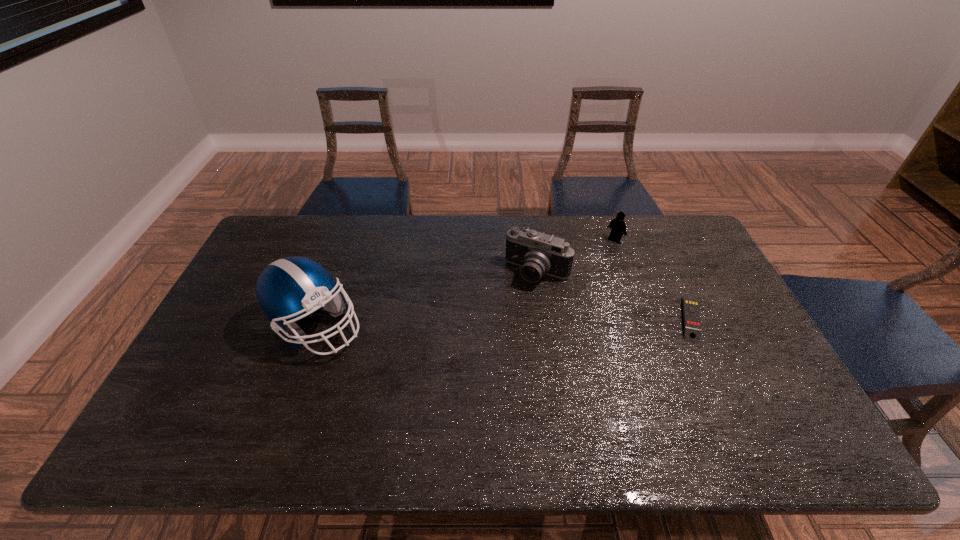
You are a GUI agent. You are given a task and a screenshot of the screen. Output one action in this format:
    pyautogui.click(x=<x>, y=<y>)
    Task: Click on the free space located 0.150m on the face of the Lego
    This screenshot has width=960, height=540.
    Given the screenshot: What is the action you would take?
    click(x=585, y=263)

You are a GUI agent. You are given a task and a screenshot of the screen. Output one action in this format:
    pyautogui.click(x=<x>, y=<y>)
    Task: Click on the vacant space located on the face of the Lego
    The image size is (960, 540).
    Given the screenshot: What is the action you would take?
    point(549,291)

Identify the location of free space located on the face of the Lego. This screenshot has height=540, width=960. (540, 298).

The image size is (960, 540). I want to click on blank space located on the front-facing side of the third shortest object, so click(508, 319).

Where is `free spot located 0.200m on the front-facing side of the third shortest object`? Image resolution: width=960 pixels, height=540 pixels. free spot located 0.200m on the front-facing side of the third shortest object is located at coordinates (499, 334).

Where is `blank space located 0.230m on the front-facing side of the third shortest object`? The height and width of the screenshot is (540, 960). blank space located 0.230m on the front-facing side of the third shortest object is located at coordinates (494, 341).

At what (x,y) coordinates should I click in order to perform the action: click on Lego that is at the far edge. Please return your answer as a coordinate pair (x, y). This screenshot has height=540, width=960. Looking at the image, I should click on (617, 225).

The height and width of the screenshot is (540, 960). In order to click on camera that is positioned at the far edge in this screenshot , I will do (537, 253).

Find the location of `object located in the left edge section of the desktop`. object located in the left edge section of the desktop is located at coordinates (289, 287).

The image size is (960, 540). I want to click on object at the right edge, so click(692, 326).